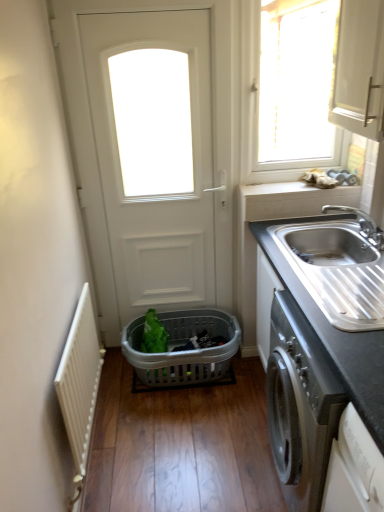
Image resolution: width=384 pixels, height=512 pixels. I want to click on gray plastic basket at center, so click(183, 351).

Where is `stainless steel sink at right`? stainless steel sink at right is located at coordinates tap(339, 267).

Measure the distance between point (116, 48) and camera.

Point (116, 48) is 6.64 feet from camera.

What is the approximate height of white painted metal radiator at left?

24.47 inches.

Image resolution: width=384 pixels, height=512 pixels. What do you see at coordinates (362, 224) in the screenshot?
I see `silver metallic faucet at sink right` at bounding box center [362, 224].

At what (x,y) coordinates should I click in order to perform the action: click on gray plastic basket at center. Please return your answer as a coordinate pair (x, y). Looking at the image, I should click on (183, 351).

From the image's perspective, relative to stainless steel sink at right, is black granite countertop at right above or below?

black granite countertop at right is below stainless steel sink at right.

Does black granite countertop at right have a greater height compared to stainless steel sink at right?

Yes.

Which object is positioned more to the left, black granite countertop at right or stainless steel sink at right?

stainless steel sink at right is more to the left.

Considering their positions, is black granite countertop at right located in front of or behind stainless steel sink at right?

black granite countertop at right is positioned farther from the viewer than stainless steel sink at right.

In terms of width, does white matte door at center look wider or thinner when compared to stainless steel sink at right?

Clearly, white matte door at center has less width compared to stainless steel sink at right.

Is white matte door at center with stainless steel sink at right?

No.

Considering the positions of objects white matte door at center and stainless steel sink at right in the image provided, who is behind, white matte door at center or stainless steel sink at right?

white matte door at center is further away from the camera.

Does white matte door at center contain stainless steel sink at right?

No.

Is white painted metal radiator at left behind white matte door at center?

No, it is not.

Considering the sizes of objects white painted metal radiator at left and white matte door at center in the image provided, who is bigger, white painted metal radiator at left or white matte door at center?

Bigger between the two is white matte door at center.

Is white painted metal radiator at left positioned with its back to white matte door at center?

No, white matte door at center is not at the back of white painted metal radiator at left.

Locate an element on the screen. The image size is (384, 512). radiator lying below the white matte door at center (from the image's perspective) is located at coordinates (80, 380).

I want to click on sink directly beneath the white plastic window at upper right (from a real-world perspective), so click(339, 267).

Looking at this image, considering their positions, is stainless steel sink at right located in front of or behind white plastic window at upper right?

Clearly, stainless steel sink at right is in front of white plastic window at upper right.

Is point (326, 315) closer or farther from the camera than point (302, 133)?

Clearly, point (326, 315) is closer to the camera than point (302, 133).

Considering the sizes of stainless steel sink at right and white plastic window at upper right in the image, is stainless steel sink at right wider or thinner than white plastic window at upper right?

Considering their sizes, stainless steel sink at right looks broader than white plastic window at upper right.

Is white painted metal radiator at left positioned far away from white plastic window at upper right?

Yes, white painted metal radiator at left and white plastic window at upper right are quite far apart.

Is white plastic window at upper right completely or partially inside white painted metal radiator at left?

No, white plastic window at upper right is located outside of white painted metal radiator at left.

Considering the relative sizes of white painted metal radiator at left and white plastic window at upper right in the image provided, is white painted metal radiator at left taller than white plastic window at upper right?

Incorrect, the height of white painted metal radiator at left is not larger of that of white plastic window at upper right.

Identify the location of basket behind the black granite countertop at right. (183, 351).

Who is shorter, gray plastic basket at center or black granite countertop at right?

gray plastic basket at center is shorter.

Can you confirm if gray plastic basket at center is bigger than black granite countertop at right?

Actually, gray plastic basket at center might be smaller than black granite countertop at right.

Is gray plastic basket at center not near black granite countertop at right?

gray plastic basket at center is actually quite close to black granite countertop at right.

How different are the orientations of black granite countertop at right and white matte door at center in degrees?

There is a 89.6-degree angle between the facing directions of black granite countertop at right and white matte door at center.

Who is bigger, black granite countertop at right or white matte door at center?

black granite countertop at right is bigger.

Considering their positions, is black granite countertop at right located in front of or behind white matte door at center?

In the image, black granite countertop at right appears in front of white matte door at center.

Where is `countertop behind the stainless steel sink at right`? countertop behind the stainless steel sink at right is located at coordinates (338, 296).

Locate an element on the screen. sink below the white matte door at center (from the image's perspective) is located at coordinates (339, 267).

Which object lies further to the anchor point white plastic window at upper right, black granite countertop at right or silver metallic faucet at sink right?

The object further to white plastic window at upper right is black granite countertop at right.

Based on the photo, considering their positions, is white plastic window at upper right positioned closer to white painted metal radiator at left than black granite countertop at right?

The object closer to white painted metal radiator at left is black granite countertop at right.

Which object lies nearer to the anchor point stainless steel sink at right, white painted metal radiator at left or white matte door at center?

Based on the image, white matte door at center appears to be nearer to stainless steel sink at right.

Looking at the image, which one is located closer to stainless steel sink at right, white painted metal radiator at left or white plastic window at upper right?

white painted metal radiator at left is positioned closer to the anchor stainless steel sink at right.

Which object lies further to the anchor point silver metallic faucet at sink right, gray plastic basket at center or white plastic window at upper right?

Among the two, white plastic window at upper right is located further to silver metallic faucet at sink right.

When comparing their distances from silver metallic faucet at sink right, does gray plastic basket at center or black granite countertop at right seem closer?

black granite countertop at right is positioned closer to the anchor silver metallic faucet at sink right.

Based on their spatial positions, is white matte door at center or silver metallic faucet at sink right closer to gray plastic basket at center?

white matte door at center.

From the image, which object appears to be farther from white painted metal radiator at left, silver metallic faucet at sink right or black granite countertop at right?

silver metallic faucet at sink right.

Where is `sink between white plastic window at upper right and black granite countertop at right vertically`? This screenshot has width=384, height=512. sink between white plastic window at upper right and black granite countertop at right vertically is located at coordinates (339, 267).

What are the coordinates of `tap between white plastic window at upper right and stainless steel sink at right from top to bottom` in the screenshot? It's located at (362, 224).

The image size is (384, 512). Find the location of `door between white painted metal radiator at left and black granite countertop at right`. door between white painted metal radiator at left and black granite countertop at right is located at coordinates (155, 168).

Image resolution: width=384 pixels, height=512 pixels. I want to click on sink between white painted metal radiator at left and silver metallic faucet at sink right, so click(x=339, y=267).